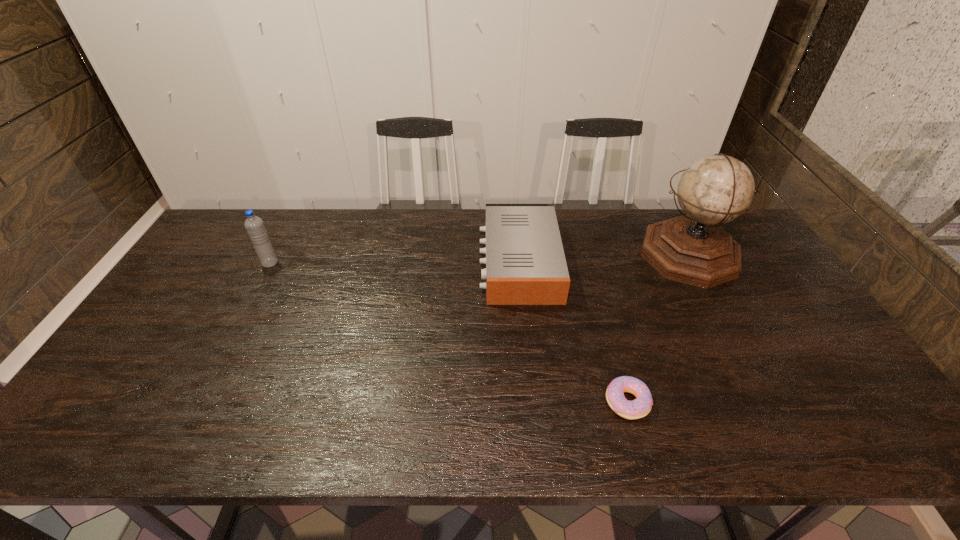
The width and height of the screenshot is (960, 540). What are the coordinates of `free space that is in between the third tallest object and the tallest object` in the screenshot? It's located at (604, 258).

At what (x,y) coordinates should I click in order to perform the action: click on free spot between the third object from right to left and the leftmost object. Please return your answer as a coordinate pair (x, y). Looking at the image, I should click on (395, 262).

In order to click on empty location between the rightmost object and the nearest object in this screenshot , I will do `click(658, 328)`.

Locate an element on the screen. Image resolution: width=960 pixels, height=540 pixels. free space that is in between the rightmost object and the doughnut is located at coordinates (658, 328).

The height and width of the screenshot is (540, 960). I want to click on vacant space that is in between the water bottle and the nearest object, so click(448, 332).

Identify the location of the second closest object to the nearest object. (692, 249).

Choose which object is the second nearest neighbor to the shortest object. Please provide its 2D coordinates. Your answer should be formatted as a tuple, i.e. [(x, y)], where the tuple contains the x and y coordinates of a point satisfying the conditions above.

[(692, 249)]

This screenshot has width=960, height=540. Identify the location of free space that satisfies the following two spatial constraints: 1. on the surface of the tallest object; 2. on the front side of the nearest object. (767, 402).

This screenshot has width=960, height=540. What are the coordinates of `free region that satisfies the following two spatial constraints: 1. on the control panel of the second shortest object; 2. on the back side of the shortest object` in the screenshot? It's located at (533, 402).

This screenshot has height=540, width=960. What are the coordinates of `vacant space that satisfies the following two spatial constraints: 1. on the control panel of the second object from left to right; 2. on the front side of the water bottle` in the screenshot? It's located at (518, 263).